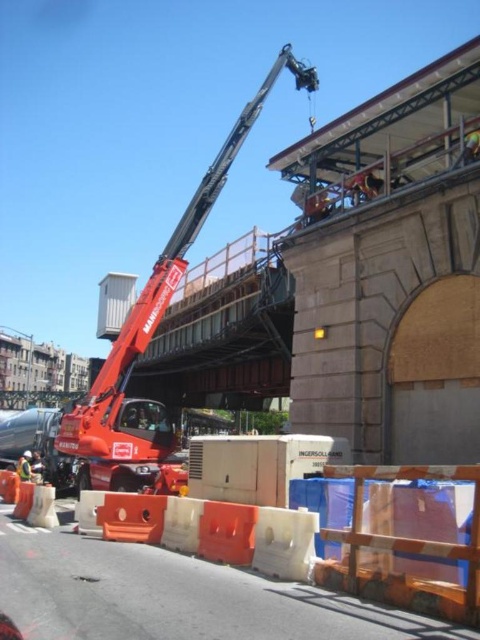
Can you confirm if red metallic crane at center is shorter than white plastic container at upper center?

No, red metallic crane at center is not shorter than white plastic container at upper center.

Measure the distance between point (120, 440) and camera.

Point (120, 440) is 100.92 feet away from camera.

This screenshot has height=640, width=480. In order to click on red metallic crane at center in this screenshot , I will do `click(151, 337)`.

The image size is (480, 640). In order to click on red metallic crane at center in this screenshot , I will do `click(151, 337)`.

Is red metallic crane at center to the left of transparent plastic barricade at lower center from the viewer's perspective?

Correct, you'll find red metallic crane at center to the left of transparent plastic barricade at lower center.

Locate an element on the screen. red metallic crane at center is located at coordinates (151, 337).

Between transparent plastic barricade at lower center and white plastic container at upper center, which one has less height?

Standing shorter between the two is transparent plastic barricade at lower center.

I want to click on transparent plastic barricade at lower center, so click(x=406, y=548).